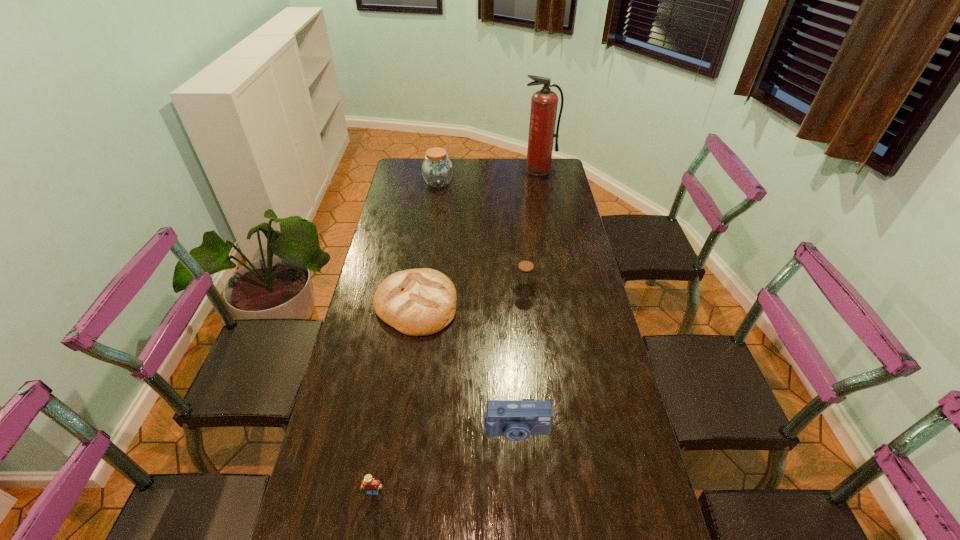
At what (x,y) coordinates should I click in order to perform the action: click on free area in between the bread and the shorter jar. Please return your answer as a coordinate pair (x, y). Looking at the image, I should click on (469, 298).

Locate an element on the screen. This screenshot has width=960, height=540. unoccupied area between the shorter jar and the second tallest object is located at coordinates (481, 237).

Where is `free area in between the fifth shortest object and the second nearest object`? The height and width of the screenshot is (540, 960). free area in between the fifth shortest object and the second nearest object is located at coordinates (477, 306).

The height and width of the screenshot is (540, 960). I want to click on object that can be found as the fifth closest to the tallest object, so click(x=369, y=483).

Select which object is the third closest to the bread. Please provide its 2D coordinates. Your answer should be formatted as a tuple, i.e. [(x, y)], where the tuple contains the x and y coordinates of a point satisfying the conditions above.

[(369, 483)]